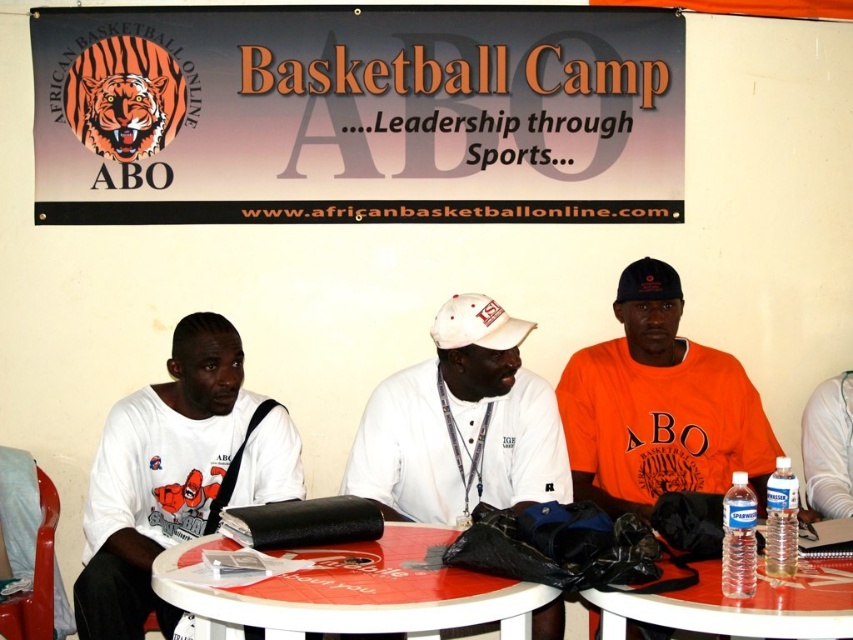
You are a photographer setting up for a group photo. You need to ensure that both the smooth plastic table at center and the clear plastic water bottles at lower right are visible in the frame. Based on their positions, which object should you focus on first to capture both in the shot?

The smooth plastic table at center is below the clear plastic water bottles at lower right, so you should focus on the clear plastic water bottles at lower right first to ensure both are in the frame.